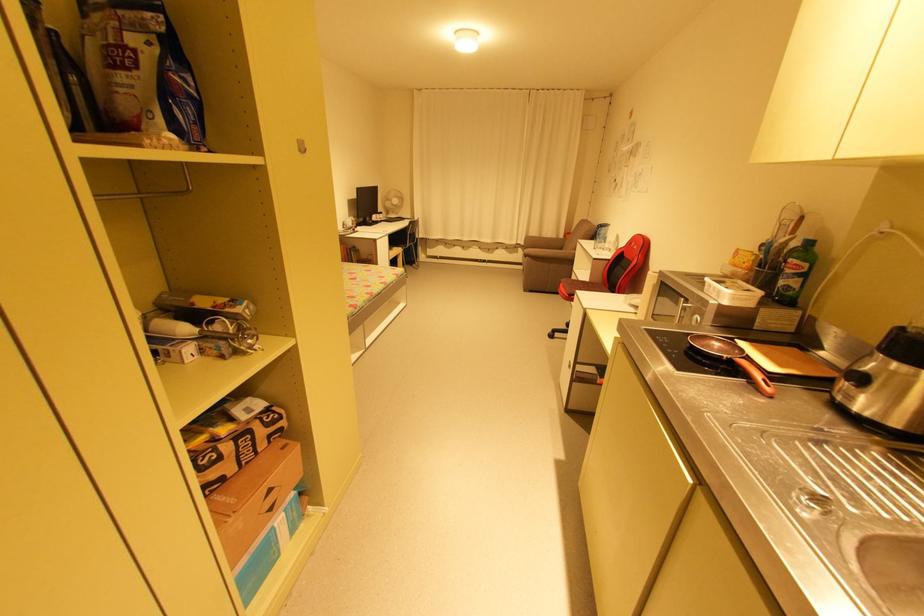
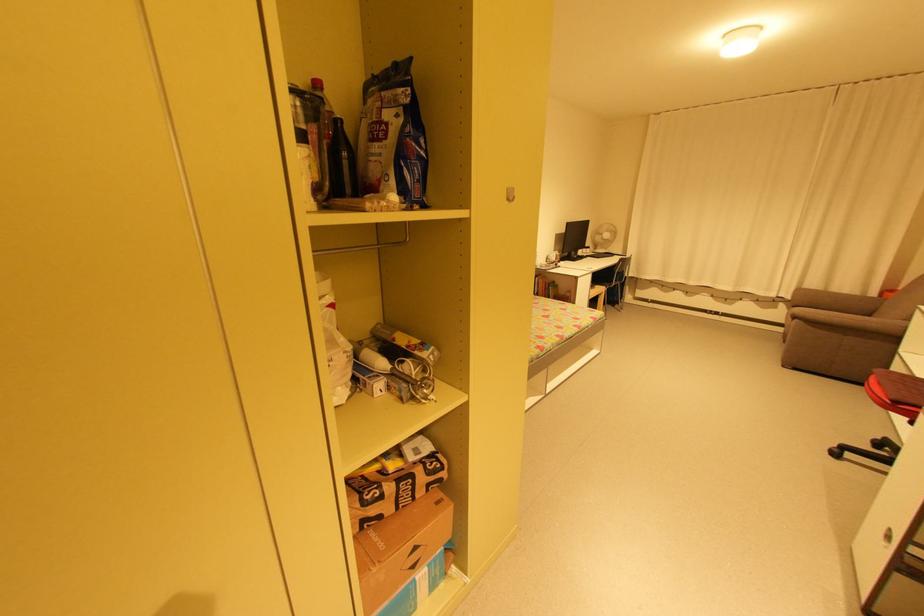
Find the pixel in the second image that matches point 83,87 in the first image.

(350, 161)